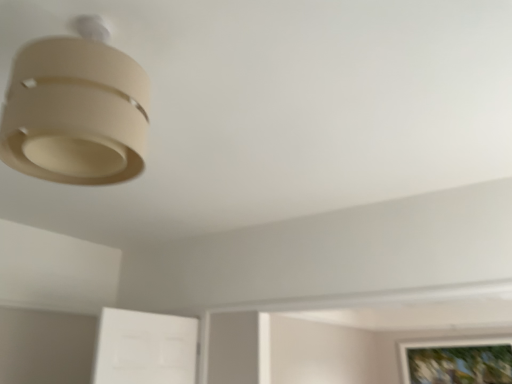
Question: Is point (47, 119) positioned closer to the camera than point (503, 360)?

Choices:
 (A) farther
 (B) closer

Answer: (B)

Question: Considering the positions of matte beige lampshade at upper left and wooden framed picture at lower right in the image, is matte beige lampshade at upper left wider or thinner than wooden framed picture at lower right?

Choices:
 (A) wide
 (B) thin

Answer: (A)

Question: From a real-world perspective, is matte beige lampshade at upper left positioned above or below wooden framed picture at lower right?

Choices:
 (A) above
 (B) below

Answer: (A)

Question: In the image, is wooden framed picture at lower right on the left side or the right side of matte beige lampshade at upper left?

Choices:
 (A) left
 (B) right

Answer: (B)

Question: Is wooden framed picture at lower right wider or thinner than matte beige lampshade at upper left?

Choices:
 (A) thin
 (B) wide

Answer: (A)

Question: Relative to matte beige lampshade at upper left, is wooden framed picture at lower right in front or behind?

Choices:
 (A) behind
 (B) front

Answer: (A)

Question: Considering the positions of wooden framed picture at lower right and matte beige lampshade at upper left in the image, is wooden framed picture at lower right taller or shorter than matte beige lampshade at upper left?

Choices:
 (A) tall
 (B) short

Answer: (A)